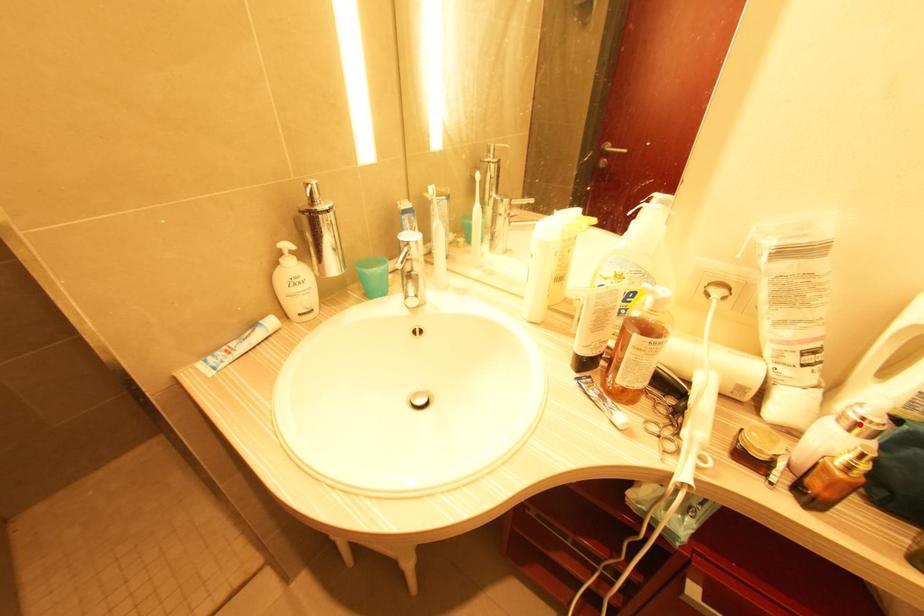
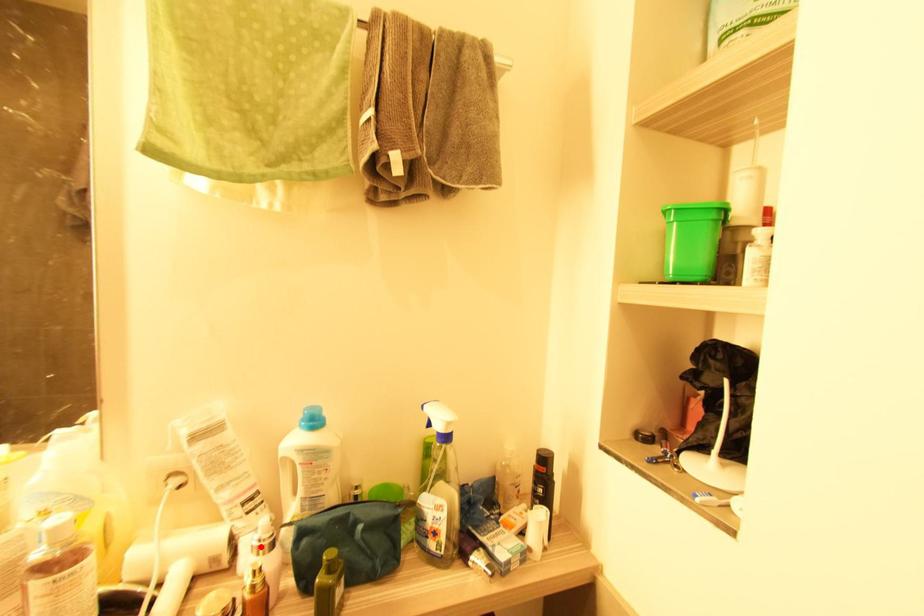
I am providing you with two images of the same scene from different viewpoints. A red point is marked on the first image and another point is marked on the second image. Are the points marked in image1 and image2 representing the same 3D position?

Yes